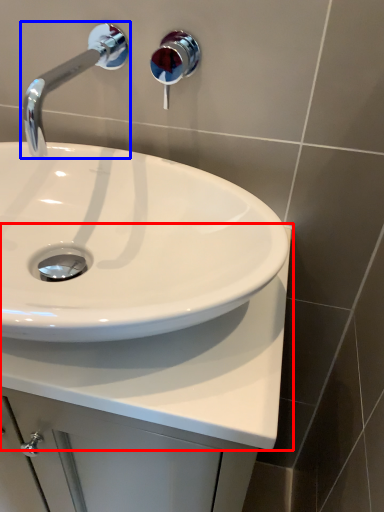
Question: Which object is closer to the camera taking this photo, counter top (highlighted by a red box) or tap (highlighted by a blue box)?

Choices:
 (A) counter top
 (B) tap

Answer: (A)